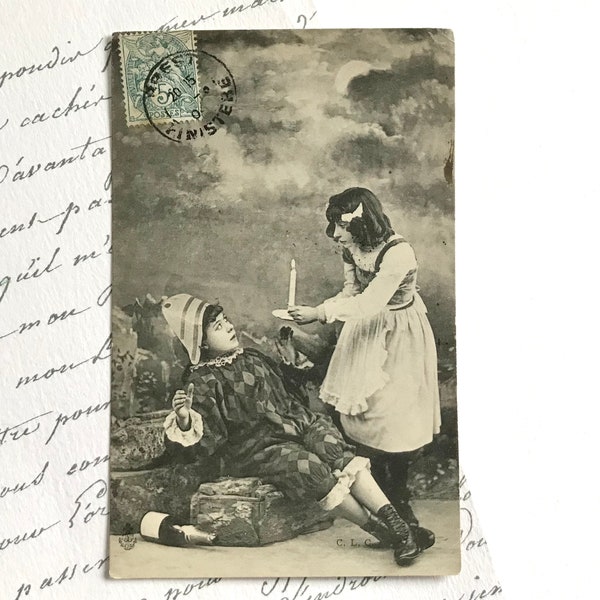
At what (x,y) coordinates should I click in order to perform the action: click on floor. Please return your answer as a coordinate pair (x, y). The height and width of the screenshot is (600, 600). Looking at the image, I should click on (313, 550).